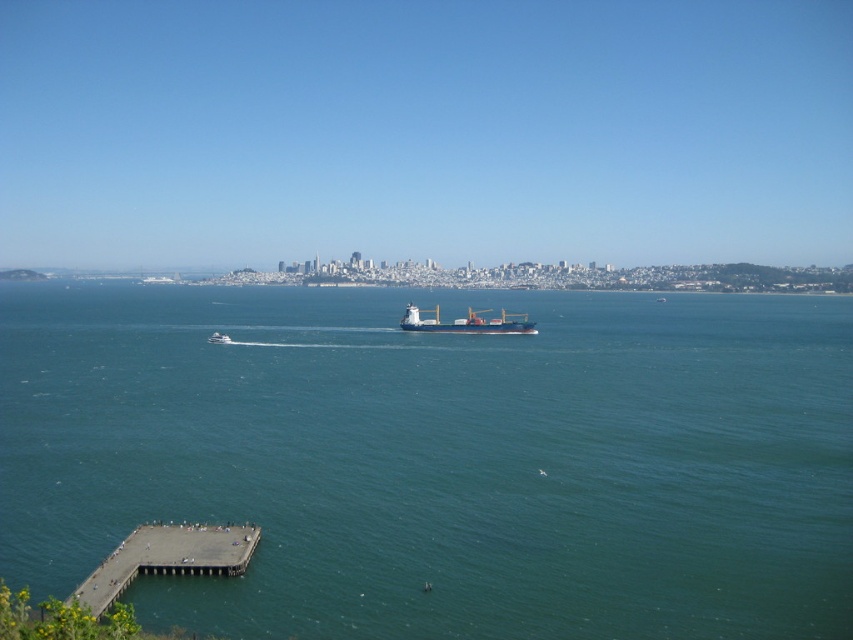
Question: Which object is the farthest from the blue water at center?

Choices:
 (A) white matte cargo ship at center
 (B) white glossy boat at center

Answer: (B)

Question: Does concrete pier at lower left appear under white matte cargo ship at center?

Choices:
 (A) no
 (B) yes

Answer: (B)

Question: In this image, where is blue water at center located relative to white glossy boat at center?

Choices:
 (A) right
 (B) left

Answer: (A)

Question: Where is white matte cargo ship at center located in relation to white glossy boat at center in the image?

Choices:
 (A) below
 (B) above

Answer: (B)

Question: Which object is closer to the camera taking this photo?

Choices:
 (A) concrete pier at lower left
 (B) blue water at center
 (C) white matte cargo ship at center
 (D) white glossy boat at center

Answer: (B)

Question: Which object appears farthest from the camera in this image?

Choices:
 (A) white matte cargo ship at center
 (B) white glossy boat at center
 (C) blue water at center
 (D) concrete pier at lower left

Answer: (A)